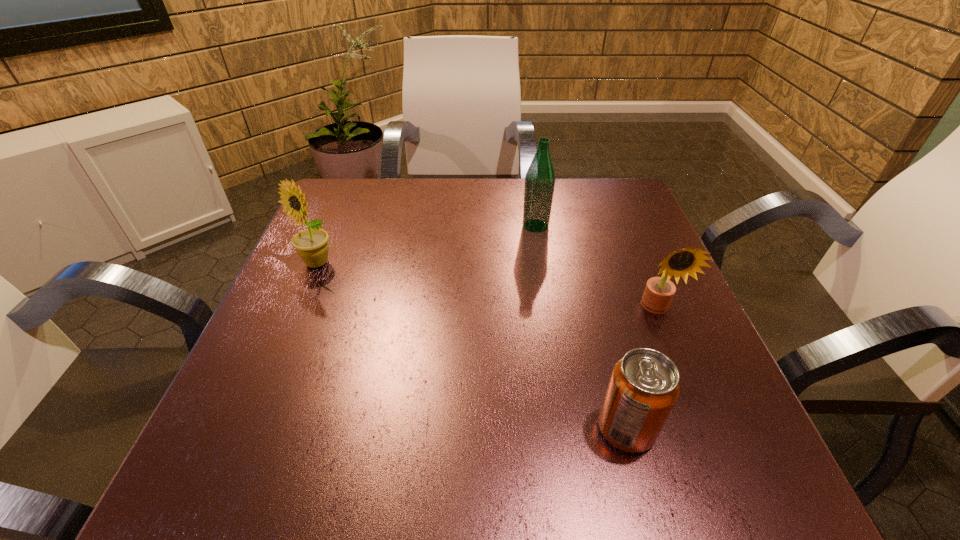
I want to click on the farthest object, so click(x=540, y=177).

Find the location of a particular element. Image resolution: width=960 pixels, height=540 pixels. bottle is located at coordinates (540, 177).

Where is `the third nearest object`? The image size is (960, 540). the third nearest object is located at coordinates (312, 246).

Find the location of `the leftmost object`. the leftmost object is located at coordinates (312, 246).

Where is `the rightmost object`? the rightmost object is located at coordinates (659, 291).

In order to click on the right sunflower in this screenshot , I will do [659, 291].

The height and width of the screenshot is (540, 960). I want to click on the shortest object, so click(x=644, y=386).

Identify the location of the nearest object. The height and width of the screenshot is (540, 960). (644, 386).

The image size is (960, 540). Identify the location of vacant region located on the left of the bottle. (501, 226).

This screenshot has width=960, height=540. Identify the location of vacant space located on the face of the farther sunflower. (237, 450).